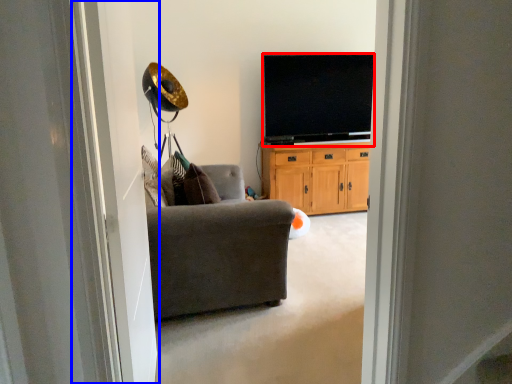
Question: Among these objects, which one is nearest to the camera, television (highlighted by a red box) or screen door (highlighted by a blue box)?

Choices:
 (A) television
 (B) screen door

Answer: (B)